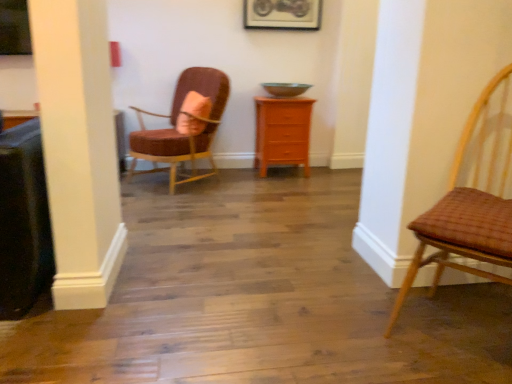
This screenshot has height=384, width=512. In order to click on vacant space underneath woven brown chair at right, the second chair viewed from the back (from a real-world perspective) in this screenshot , I will do `click(461, 328)`.